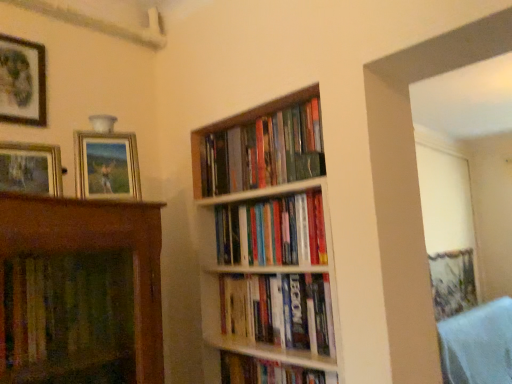
The width and height of the screenshot is (512, 384). What do you see at coordinates (272, 232) in the screenshot?
I see `hardcover books at center, which is counted as the second book, starting from the top` at bounding box center [272, 232].

Locate an element on the screen. The width and height of the screenshot is (512, 384). hardcover books at center, which is counted as the second book, starting from the top is located at coordinates (272, 232).

The image size is (512, 384). Describe the element at coordinates (268, 239) in the screenshot. I see `wooden bookshelf at center` at that location.

This screenshot has height=384, width=512. I want to click on matte wooden picture frame at left, which ranks as the first picture frame in front-to-back order, so (31, 168).

Identify the location of hardcover books at center, the second book positioned from the bottom. Image resolution: width=512 pixels, height=384 pixels. (279, 310).

You are a GUI agent. You are given a task and a screenshot of the screen. Output one action in this format:
    pyautogui.click(x=<x>, y=<y>)
    Task: Click on the hardcover books at center, which is counted as the second book, starting from the top
    Image resolution: width=512 pixels, height=384 pixels.
    Given the screenshot: What is the action you would take?
    pyautogui.click(x=272, y=232)

Which of these two, hardcover books at center, the second book positioned from the bottom, or wooden picture frame at upper left, which ranks as the 1th picture frame in right-to-left order, is thinner?

wooden picture frame at upper left, which ranks as the 1th picture frame in right-to-left order, is thinner.

Is wooden picture frame at upper left, the second picture frame in the back-to-front sequence, at the back of hardcover books at center, the second book positioned from the bottom?

No.

Which point is more forward, (x=298, y=348) or (x=75, y=149)?

The point (x=75, y=149) is closer.

Can you see hardcover books at center, the 3th book from the top, touching wooden picture frame at upper left, the 2th picture frame from the front?

They are not placed beside each other.

Looking at this image, from the image's perspective, which is below, hardcover books at center, which is counted as the second book, starting from the top, or matte black picture frame at upper left, the 1th picture frame positioned from the back?

hardcover books at center, which is counted as the second book, starting from the top, appears lower in the image.

Considering the sizes of objects hardcover books at center, which is counted as the second book, starting from the top, and matte black picture frame at upper left, which is the 1th picture frame in left-to-right order, in the image provided, who is wider, hardcover books at center, which is counted as the second book, starting from the top, or matte black picture frame at upper left, which is the 1th picture frame in left-to-right order,?

Wider between the two is hardcover books at center, which is counted as the second book, starting from the top.

Does hardcover books at center, positioned as the third book in bottom-to-top order, contain matte black picture frame at upper left, which is the 3th picture frame from right to left?

That's incorrect, matte black picture frame at upper left, which is the 3th picture frame from right to left, is not inside hardcover books at center, positioned as the third book in bottom-to-top order.

Does point (224, 212) lie in front of point (42, 81)?

No, it is not.

Could you tell me if hardcover books at center, positioned as the third book in bottom-to-top order, is facing matte wooden picture frame at left, positioned as the third picture frame in back-to-front order?

Yes, hardcover books at center, positioned as the third book in bottom-to-top order, is oriented towards matte wooden picture frame at left, positioned as the third picture frame in back-to-front order.

Which is more to the left, hardcover books at center, which is counted as the second book, starting from the top, or matte wooden picture frame at left, which ranks as the second picture frame in left-to-right order?

Positioned to the left is matte wooden picture frame at left, which ranks as the second picture frame in left-to-right order.

How many degrees apart are the facing directions of hardcover books at center, positioned as the third book in bottom-to-top order, and matte wooden picture frame at left, which ranks as the second picture frame in left-to-right order?

hardcover books at center, positioned as the third book in bottom-to-top order, and matte wooden picture frame at left, which ranks as the second picture frame in left-to-right order, are facing 88.1 degrees away from each other.

Considering the sizes of objects hardcover books at center, positioned as the third book in bottom-to-top order, and matte wooden picture frame at left, which ranks as the first picture frame in front-to-back order, in the image provided, who is shorter, hardcover books at center, positioned as the third book in bottom-to-top order, or matte wooden picture frame at left, which ranks as the first picture frame in front-to-back order,?

matte wooden picture frame at left, which ranks as the first picture frame in front-to-back order.

Considering the positions of objects wooden bookshelf at center and hardcover books at center, which appears as the 4th book when ordered from the bottom, in the image provided, who is more to the left, wooden bookshelf at center or hardcover books at center, which appears as the 4th book when ordered from the bottom,?

From the viewer's perspective, wooden bookshelf at center appears more on the left side.

Is wooden bookshelf at center shorter than hardcover books at center, arranged as the 1th book when viewed from the top?

No.

Considering the points (294, 196) and (216, 137), which point is in front, point (294, 196) or point (216, 137)?

The point (294, 196) is closer to the camera.

Considering the relative sizes of matte wooden picture frame at left, the 2th picture frame when ordered from right to left, and hardcover book at center, the first book positioned from the bottom, in the image provided, is matte wooden picture frame at left, the 2th picture frame when ordered from right to left, smaller than hardcover book at center, the first book positioned from the bottom,?

Correct, matte wooden picture frame at left, the 2th picture frame when ordered from right to left, occupies less space than hardcover book at center, the first book positioned from the bottom.

In the scene shown: Choose the correct answer: Is matte wooden picture frame at left, which ranks as the second picture frame in left-to-right order, inside hardcover book at center, the first book positioned from the bottom, or outside it?

matte wooden picture frame at left, which ranks as the second picture frame in left-to-right order, is not enclosed by hardcover book at center, the first book positioned from the bottom.

How distant is matte wooden picture frame at left, positioned as the third picture frame in back-to-front order, from hardcover book at center, marked as the fourth book in a top-to-bottom arrangement?

88.60 centimeters.

From the image's perspective, would you say matte wooden picture frame at left, which ranks as the first picture frame in front-to-back order, is positioned over hardcover book at center, the first book positioned from the bottom?

Yes, from the image's perspective, matte wooden picture frame at left, which ranks as the first picture frame in front-to-back order, is on top of hardcover book at center, the first book positioned from the bottom.

In order to click on the 2nd book above the wooden bookshelf at center (from the image's perspective) in this screenshot , I will do `click(261, 152)`.

Is hardcover books at center, which appears as the 4th book when ordered from the bottom, not inside wooden bookshelf at center?

Actually, hardcover books at center, which appears as the 4th book when ordered from the bottom, is at least partially inside wooden bookshelf at center.

Is hardcover books at center, arranged as the 1th book when viewed from the top, taller or shorter than wooden bookshelf at center?

In the image, hardcover books at center, arranged as the 1th book when viewed from the top, appears to be shorter than wooden bookshelf at center.

Considering the relative sizes of hardcover books at center, which appears as the 4th book when ordered from the bottom, and wooden bookshelf at center in the image provided, is hardcover books at center, which appears as the 4th book when ordered from the bottom, smaller than wooden bookshelf at center?

Indeed, hardcover books at center, which appears as the 4th book when ordered from the bottom, has a smaller size compared to wooden bookshelf at center.

Can you confirm if wooden picture frame at upper left, which ranks as the 3th picture frame in left-to-right order, is thinner than matte black picture frame at upper left, the 1th picture frame positioned from the back?

No, wooden picture frame at upper left, which ranks as the 3th picture frame in left-to-right order, is not thinner than matte black picture frame at upper left, the 1th picture frame positioned from the back.

At what (x,y) coordinates should I click in order to perform the action: click on the 1st picture frame in front of the matte black picture frame at upper left, the 1th picture frame positioned from the back, starting your count from the anchor. Please return your answer as a coordinate pair (x, y). Looking at the image, I should click on (106, 165).

Would you say wooden picture frame at upper left, which ranks as the 1th picture frame in right-to-left order, is inside or outside matte black picture frame at upper left, which is the 1th picture frame in left-to-right order?

wooden picture frame at upper left, which ranks as the 1th picture frame in right-to-left order, is not inside matte black picture frame at upper left, which is the 1th picture frame in left-to-right order, it's outside.

Does wooden picture frame at upper left, which ranks as the 3th picture frame in left-to-right order, have a larger size compared to matte black picture frame at upper left, the 1th picture frame positioned from the back?

No.

From a real-world perspective, which book is the 2nd one underneath the wooden picture frame at upper left, the second picture frame in the back-to-front sequence? Please provide its 2D coordinates.

[(279, 310)]

At what (x,y) coordinates should I click in order to perform the action: click on the 3rd book in front of the matte black picture frame at upper left, the 1th picture frame positioned from the back, counting from the anchor's position. Please return your answer as a coordinate pair (x, y). Looking at the image, I should click on (x=272, y=232).

Based on their spatial positions, is hardcover books at center, the 3th book from the top, or matte wooden picture frame at left, the 2th picture frame when ordered from right to left, further from matte black picture frame at upper left, the 1th picture frame positioned from the back?

The object further to matte black picture frame at upper left, the 1th picture frame positioned from the back, is hardcover books at center, the 3th book from the top.

Estimate the real-world distances between objects in this image. Which object is closer to hardcover books at center, arranged as the 1th book when viewed from the top, hardcover books at center, which is counted as the second book, starting from the top, or hardcover book at center, marked as the fourth book in a top-to-bottom arrangement?

Among the two, hardcover books at center, which is counted as the second book, starting from the top, is located nearer to hardcover books at center, arranged as the 1th book when viewed from the top.

From the image, which object appears to be farther from hardcover books at center, positioned as the third book in bottom-to-top order, hardcover books at center, the 3th book from the top, or hardcover books at center, which appears as the 4th book when ordered from the bottom?

Based on the image, hardcover books at center, which appears as the 4th book when ordered from the bottom, appears to be further to hardcover books at center, positioned as the third book in bottom-to-top order.

Based on their spatial positions, is hardcover books at center, arranged as the 1th book when viewed from the top, or hardcover books at center, the 3th book from the top, closer to wooden picture frame at upper left, the 2th picture frame from the front?

hardcover books at center, arranged as the 1th book when viewed from the top, is closer to wooden picture frame at upper left, the 2th picture frame from the front.

Considering their positions, is matte black picture frame at upper left, placed as the 3th picture frame when sorted from front to back, positioned further to wooden bookshelf at center than matte wooden picture frame at left, which ranks as the first picture frame in front-to-back order?

The object further to wooden bookshelf at center is matte black picture frame at upper left, placed as the 3th picture frame when sorted from front to back.

When comparing their distances from hardcover book at center, marked as the fourth book in a top-to-bottom arrangement, does matte black picture frame at upper left, which is the 3th picture frame from right to left, or hardcover books at center, the 3th book from the top, seem closer?

The object closer to hardcover book at center, marked as the fourth book in a top-to-bottom arrangement, is hardcover books at center, the 3th book from the top.

Looking at the image, which one is located closer to hardcover books at center, the second book positioned from the bottom, hardcover book at center, marked as the fourth book in a top-to-bottom arrangement, or hardcover books at center, which is counted as the second book, starting from the top?

hardcover books at center, which is counted as the second book, starting from the top, is closer to hardcover books at center, the second book positioned from the bottom.

From the image, which object appears to be farther from hardcover books at center, the second book positioned from the bottom, matte wooden picture frame at left, the 2th picture frame when ordered from right to left, or wooden bookshelf at center?

matte wooden picture frame at left, the 2th picture frame when ordered from right to left, is positioned further to the anchor hardcover books at center, the second book positioned from the bottom.

Find the location of `shelf situated between matte wooden picture frame at left, which ranks as the second picture frame in left-to-right order, and hardcover books at center, positioned as the third book in bottom-to-top order, from left to right`. shelf situated between matte wooden picture frame at left, which ranks as the second picture frame in left-to-right order, and hardcover books at center, positioned as the third book in bottom-to-top order, from left to right is located at coordinates (268, 239).

Find the location of a particular element. The height and width of the screenshot is (384, 512). picture frame between matte wooden picture frame at left, which ranks as the first picture frame in front-to-back order, and hardcover books at center, the 3th book from the top is located at coordinates (106, 165).

This screenshot has height=384, width=512. Identify the location of picture frame located between matte wooden picture frame at left, which ranks as the first picture frame in front-to-back order, and hardcover books at center, which appears as the 4th book when ordered from the bottom, in the left-right direction. (106, 165).

Find the location of a particular element. Image resolution: width=512 pixels, height=384 pixels. book between hardcover books at center, positioned as the third book in bottom-to-top order, and hardcover book at center, the first book positioned from the bottom, in the vertical direction is located at coordinates (279, 310).